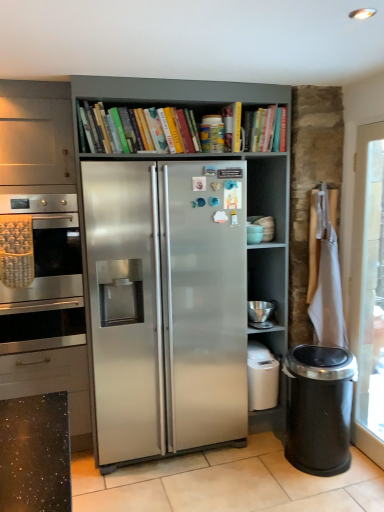
Question: Is white glossy tile at center not close to matte ceramic bowls at upper right, the 2th appliance in the bottom-to-top sequence?

Choices:
 (A) no
 (B) yes

Answer: (B)

Question: Are white glossy tile at center and matte ceramic bowls at upper right, which is the first appliance from top to bottom, beside each other?

Choices:
 (A) no
 (B) yes

Answer: (A)

Question: Is white glossy tile at center oriented towards matte ceramic bowls at upper right, which is the first appliance from top to bottom?

Choices:
 (A) no
 (B) yes

Answer: (A)

Question: Is white glossy tile at center bigger than matte ceramic bowls at upper right, which is the first appliance from top to bottom?

Choices:
 (A) yes
 (B) no

Answer: (A)

Question: Is white glossy tile at center positioned beyond the bounds of matte ceramic bowls at upper right, the 2th appliance in the bottom-to-top sequence?

Choices:
 (A) yes
 (B) no

Answer: (A)

Question: From the image's perspective, is white glossy tile at center below matte ceramic bowls at upper right, the 2th appliance in the bottom-to-top sequence?

Choices:
 (A) no
 (B) yes

Answer: (B)

Question: Considering the relative positions of satin silver fridge at center and hardcover books at upper center in the image provided, is satin silver fridge at center to the right of hardcover books at upper center from the viewer's perspective?

Choices:
 (A) no
 (B) yes

Answer: (B)

Question: Would you say satin silver fridge at center is outside hardcover books at upper center?

Choices:
 (A) yes
 (B) no

Answer: (A)

Question: Is satin silver fridge at center taller than hardcover books at upper center?

Choices:
 (A) no
 (B) yes

Answer: (B)

Question: Does satin silver fridge at center have a smaller size compared to hardcover books at upper center?

Choices:
 (A) no
 (B) yes

Answer: (A)

Question: Could you tell me if satin silver fridge at center is facing hardcover books at upper center?

Choices:
 (A) no
 (B) yes

Answer: (B)

Question: Is satin silver fridge at center surrounding hardcover books at upper center?

Choices:
 (A) no
 (B) yes

Answer: (B)

Question: Is stainless steel oven at left not within hardcover books at upper center?

Choices:
 (A) no
 (B) yes

Answer: (B)